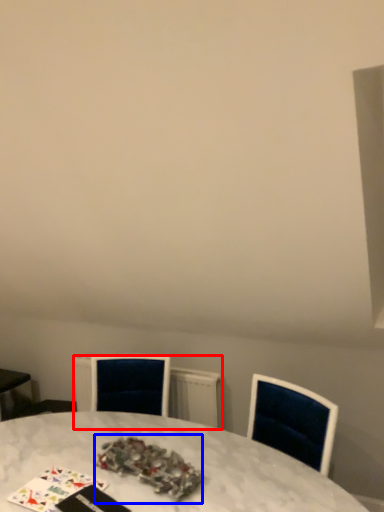
Question: Among these objects, which one is farthest to the camera, radiator (highlighted by a red box) or christmas decoration (highlighted by a blue box)?

Choices:
 (A) radiator
 (B) christmas decoration

Answer: (A)